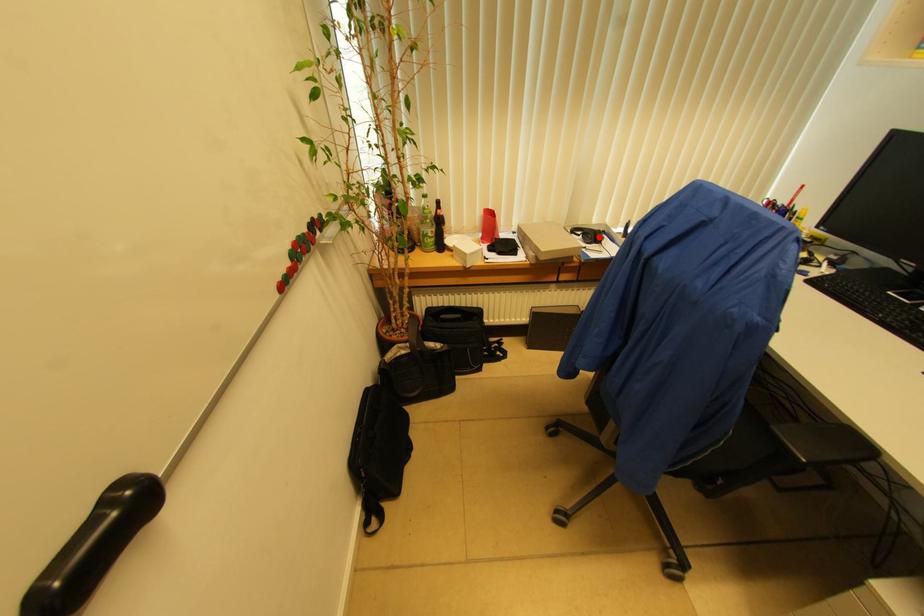
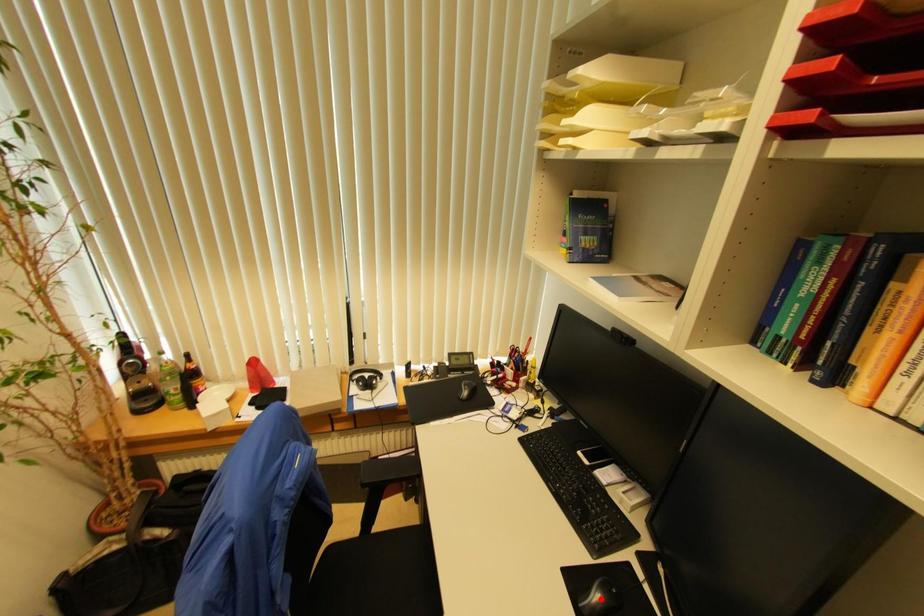
I am providing you with two images of the same scene from different viewpoints. A red point is marked on the first image and another point is marked on the second image. Is the red point in image1 aligned with the point shown in image2?

No